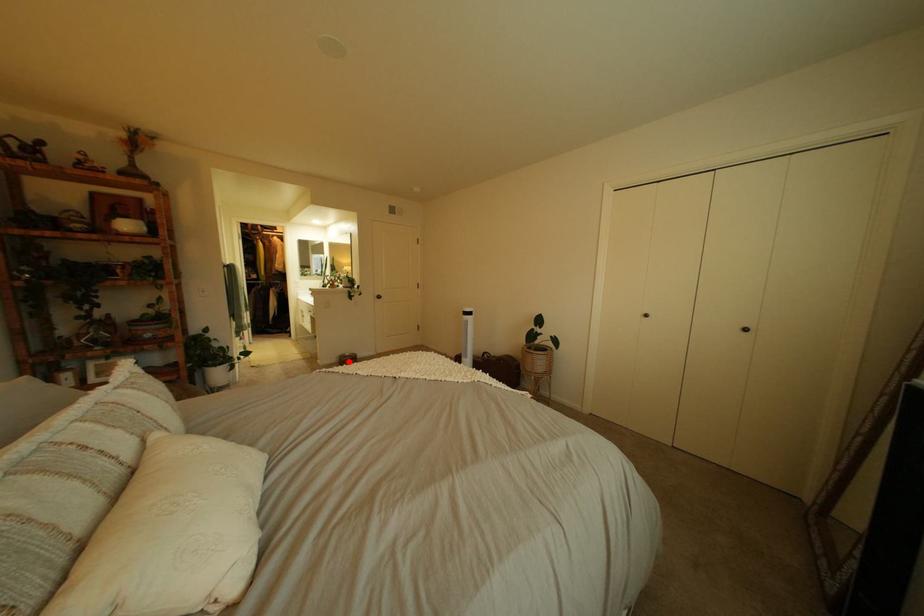
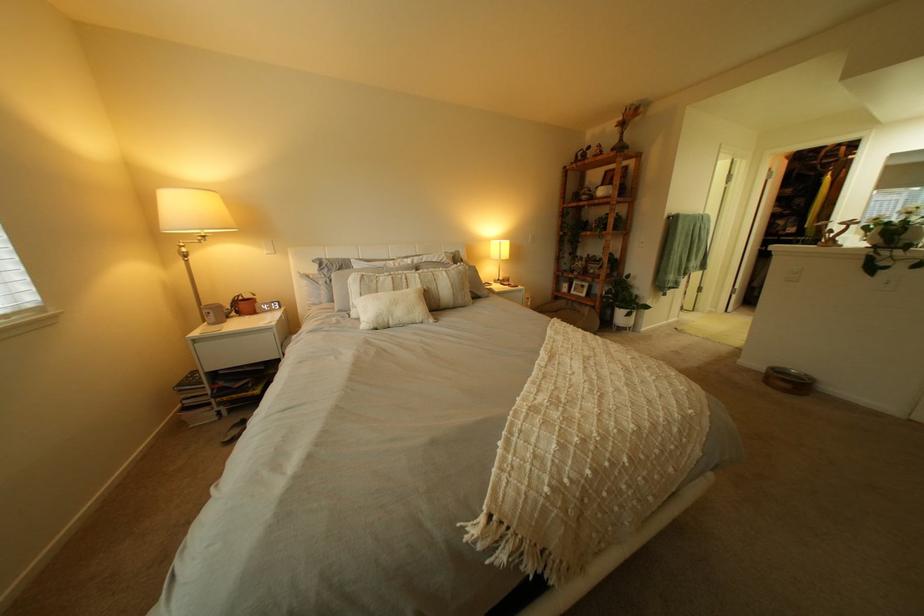
Question: I am providing you with two images of the same scene from different viewpoints. A red point is marked on the first image. Is the red point's position out of view in image 2?

Choices:
 (A) Yes
 (B) No

Answer: (B)